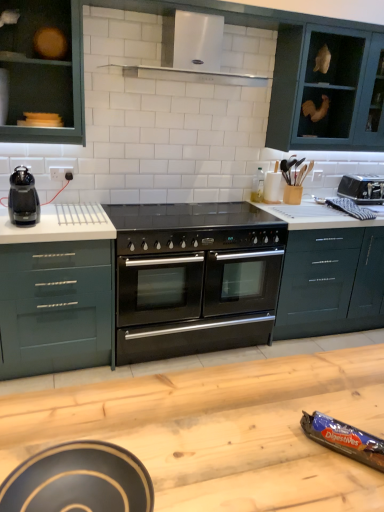
I want to click on unoccupied region to the right of matte black bowl at lower left, arranged as the 1th appliance when viewed from the front, so click(x=214, y=473).